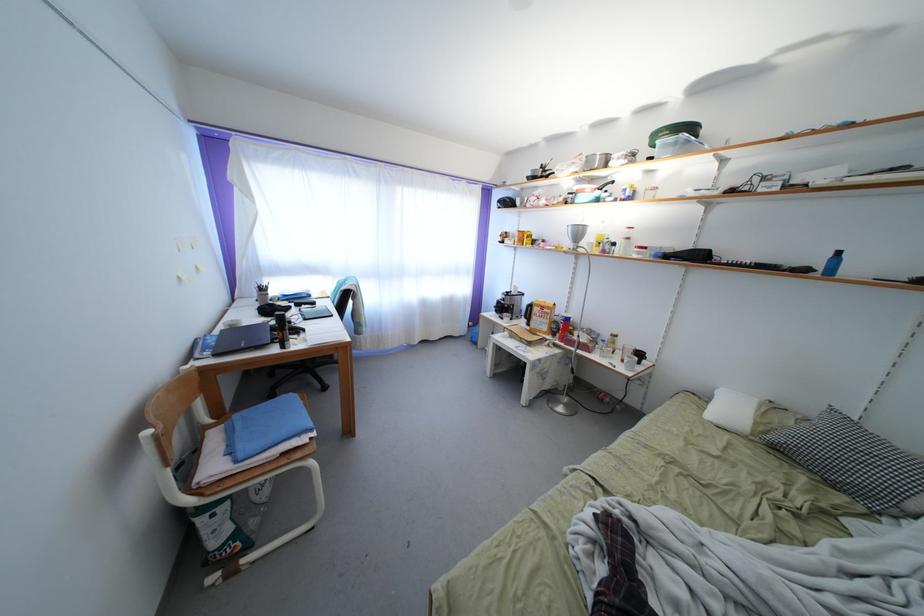
This screenshot has height=616, width=924. In order to click on white mug handle in this screenshot , I will do `click(629, 363)`.